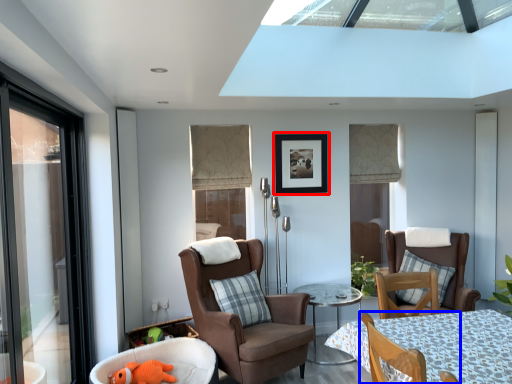
Question: Which of the following is the closest to the observer, picture frame (highlighted by a red box) or chair (highlighted by a blue box)?

Choices:
 (A) picture frame
 (B) chair

Answer: (B)